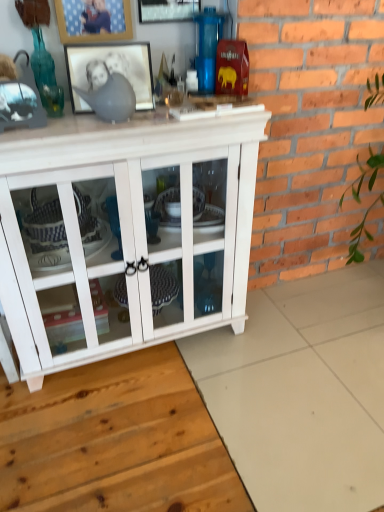
Question: In the image, is wooden picture frame at upper center, the second picture frame in the bottom-to-top sequence, positioned in front of or behind white wood cabinet at center?

Choices:
 (A) behind
 (B) front

Answer: (A)

Question: Is wooden picture frame at upper center, the second picture frame in the bottom-to-top sequence, wider or thinner than white wood cabinet at center?

Choices:
 (A) thin
 (B) wide

Answer: (A)

Question: Based on their relative distances, which object is nearer to the wooden picture frame at upper center, the second picture frame in the bottom-to-top sequence?

Choices:
 (A) white wood cabinet at center
 (B) black matte picture frame at upper center, which ranks as the 1th picture frame in bottom-to-top order
 (C) metallic silver picture frame at upper center, which appears as the 1th picture frame when viewed from the top

Answer: (B)

Question: Which object is positioned closest to the wooden picture frame at upper center, the second picture frame in the bottom-to-top sequence?

Choices:
 (A) black matte picture frame at upper center, which is counted as the third picture frame, starting from the top
 (B) metallic silver picture frame at upper center, acting as the third picture frame starting from the bottom
 (C) white wood cabinet at center

Answer: (A)